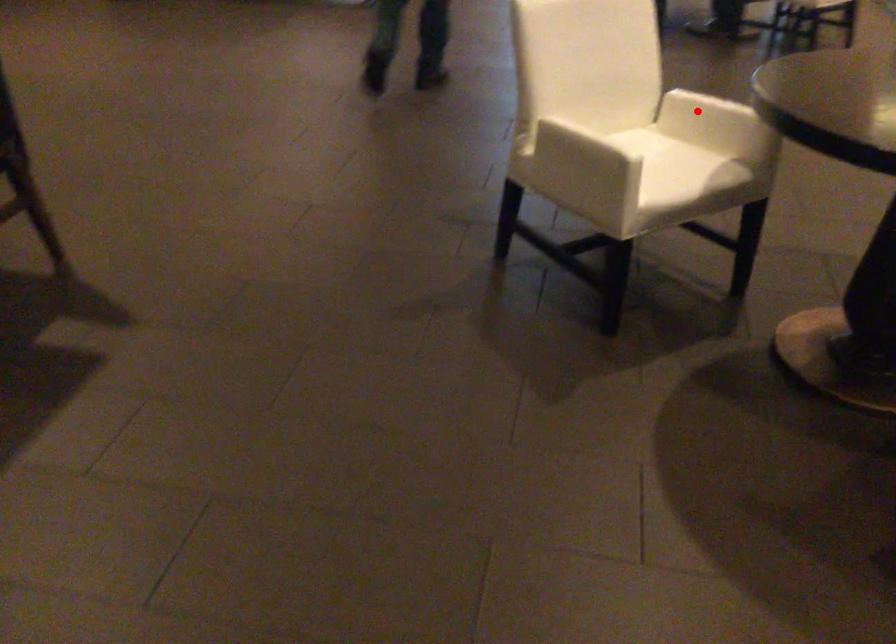
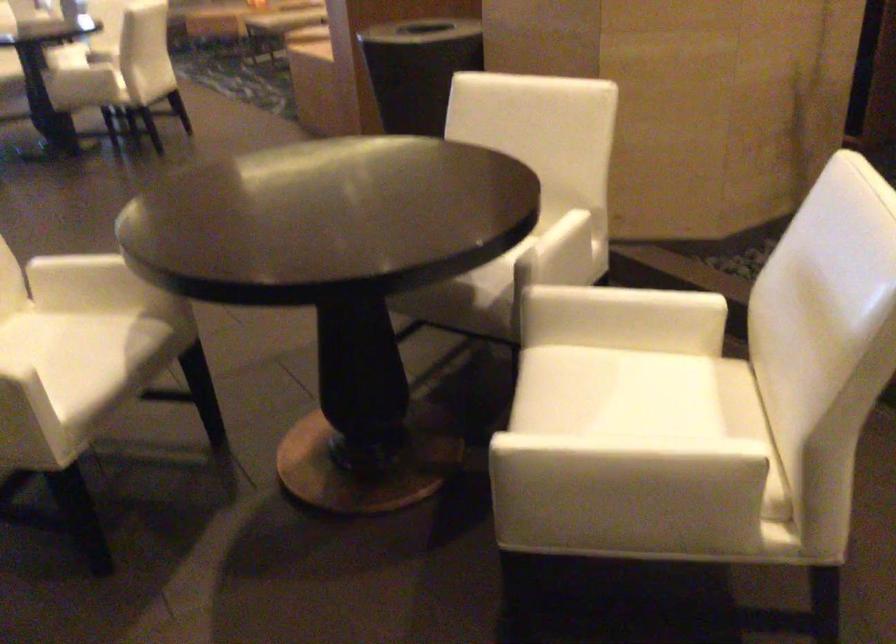
Question: I am providing you with two images of the same scene from different viewpoints. In image1, a red point is highlighted. Considering the same 3D point in image2, which of the following is correct?

Choices:
 (A) It is closer
 (B) It is farther

Answer: (A)